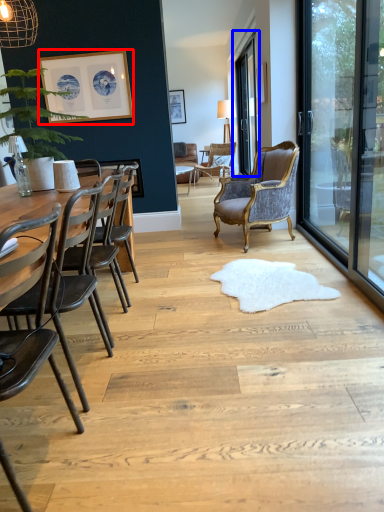
Question: Which of the following is the farthest to the observer, picture frame (highlighted by a red box) or window screen (highlighted by a blue box)?

Choices:
 (A) picture frame
 (B) window screen

Answer: (B)